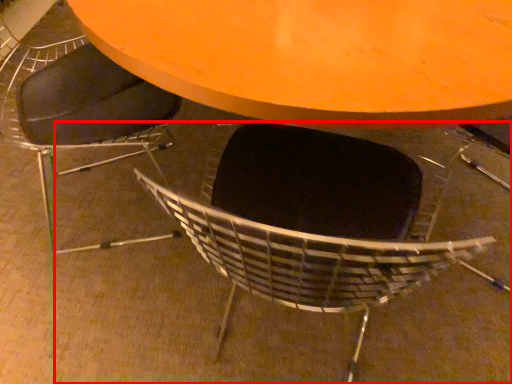
Question: In this image, where is chair (annotated by the red box) located relative to chair?

Choices:
 (A) right
 (B) left

Answer: (A)